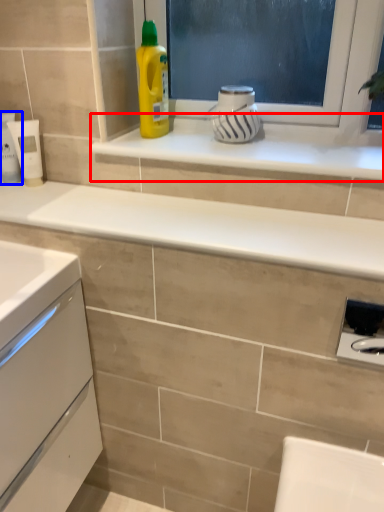
Question: Which object appears farthest to the camera in this image, window sill (highlighted by a red box) or toiletry (highlighted by a blue box)?

Choices:
 (A) window sill
 (B) toiletry

Answer: (B)